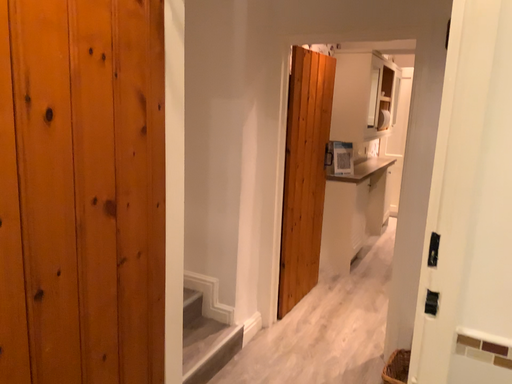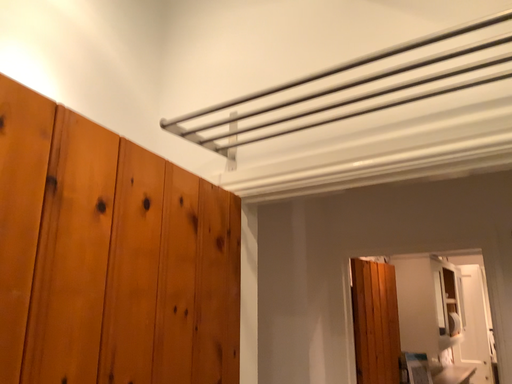
Question: Which way did the camera rotate in the video?

Choices:
 (A) rotated left
 (B) rotated right

Answer: (A)